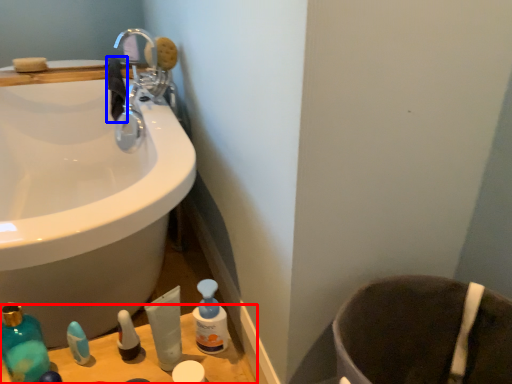
Question: Among these objects, which one is nearest to the camera, counter top (highlighted by a red box) or hand towel (highlighted by a blue box)?

Choices:
 (A) counter top
 (B) hand towel

Answer: (A)